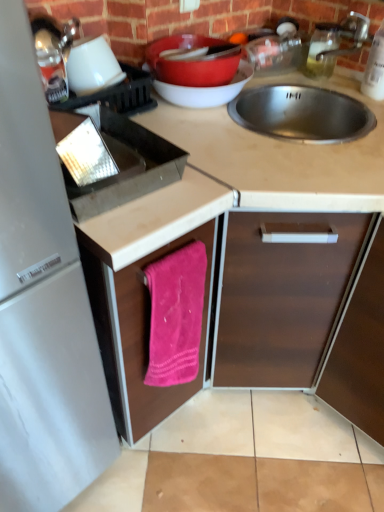
Question: Is silver metallic faucet at upper right shorter than clear glass bottle at upper right, arranged as the first bottle when viewed from the back?

Choices:
 (A) no
 (B) yes

Answer: (B)

Question: Is silver metallic faucet at upper right to the left of clear glass bottle at upper right, which is the 2th bottle from right to left, from the viewer's perspective?

Choices:
 (A) yes
 (B) no

Answer: (B)

Question: From a real-world perspective, is silver metallic faucet at upper right located higher than clear glass bottle at upper right, the 2th bottle viewed from the front?

Choices:
 (A) no
 (B) yes

Answer: (B)

Question: Is clear glass bottle at upper right, which is the 2th bottle from right to left, surrounded by silver metallic faucet at upper right?

Choices:
 (A) no
 (B) yes

Answer: (A)

Question: Can you confirm if silver metallic faucet at upper right is bigger than clear glass bottle at upper right, the 2th bottle viewed from the front?

Choices:
 (A) yes
 (B) no

Answer: (B)

Question: Is silver metallic faucet at upper right placed right next to clear glass bottle at upper right, the 1th bottle when ordered from left to right?

Choices:
 (A) no
 (B) yes

Answer: (B)

Question: From the image's perspective, is matte brown countertop at center on top of clear glass bottle at upper right, the 2th bottle viewed from the front?

Choices:
 (A) yes
 (B) no

Answer: (B)

Question: Does matte brown countertop at center have a lesser width compared to clear glass bottle at upper right, arranged as the first bottle when viewed from the back?

Choices:
 (A) no
 (B) yes

Answer: (A)

Question: Does matte brown countertop at center have a larger size compared to clear glass bottle at upper right, the 2th bottle viewed from the front?

Choices:
 (A) yes
 (B) no

Answer: (A)

Question: From a real-world perspective, is matte brown countertop at center positioned over clear glass bottle at upper right, the 1th bottle when ordered from left to right, based on gravity?

Choices:
 (A) yes
 (B) no

Answer: (B)

Question: Is clear glass bottle at upper right, the 1th bottle when ordered from left to right, located within matte brown countertop at center?

Choices:
 (A) yes
 (B) no

Answer: (B)

Question: Considering the relative sizes of matte brown countertop at center and clear glass bottle at upper right, the 2th bottle viewed from the front, in the image provided, is matte brown countertop at center smaller than clear glass bottle at upper right, the 2th bottle viewed from the front,?

Choices:
 (A) no
 (B) yes

Answer: (A)

Question: Is there a large distance between silver metallic faucet at upper right and pink fabric towel at lower center, which is the second cabinetry in right-to-left order?

Choices:
 (A) yes
 (B) no

Answer: (A)